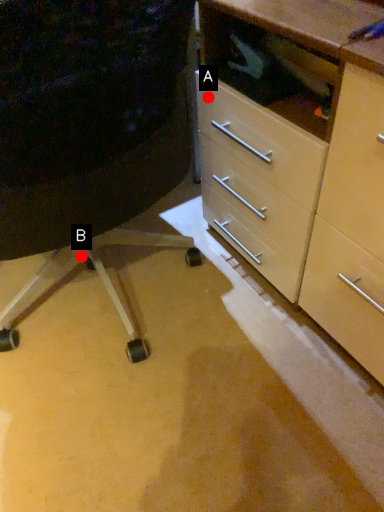
Question: Two points are circled on the image, labeled by A and B beside each circle. Which point appears farthest from the camera in this image?

Choices:
 (A) A is further
 (B) B is further

Answer: (B)